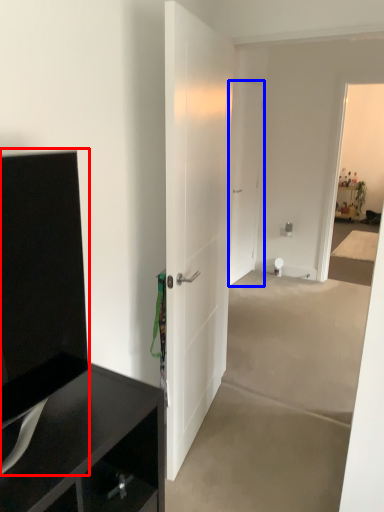
Question: Among these objects, which one is nearest to the camera, tv cabinet (highlighted by a red box) or door (highlighted by a blue box)?

Choices:
 (A) tv cabinet
 (B) door

Answer: (A)